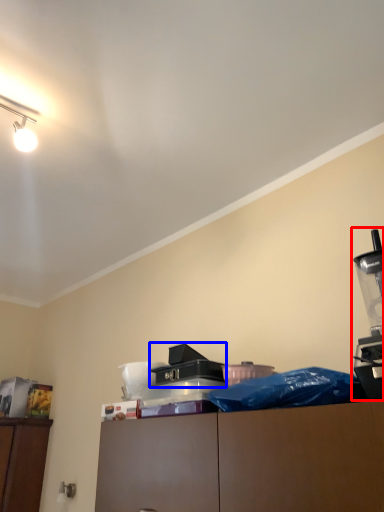
Question: Among these objects, which one is nearest to the camera, coffee machine (highlighted by a red box) or job (highlighted by a blue box)?

Choices:
 (A) coffee machine
 (B) job

Answer: (A)